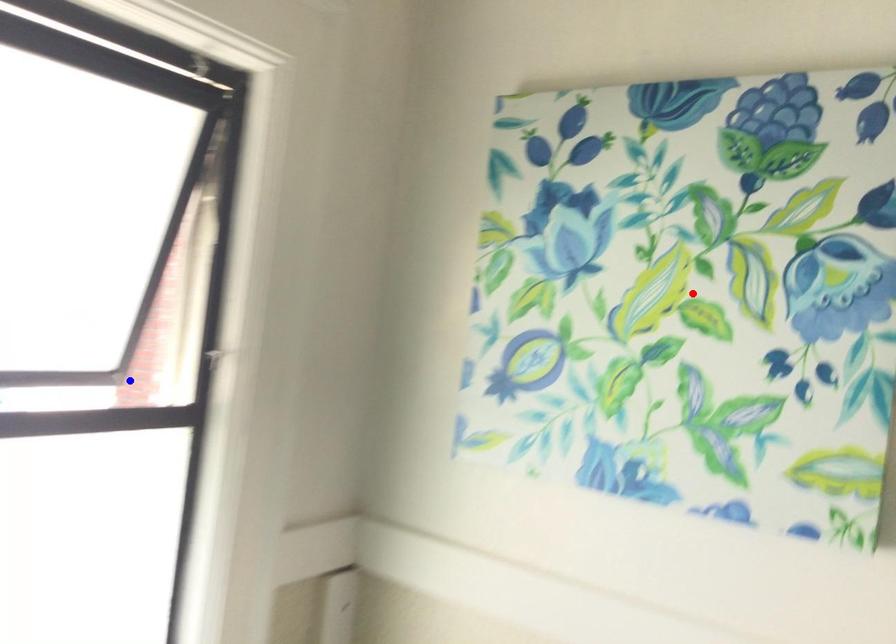
Question: Two points are marked on the image. Which point is closer to the camera?

Choices:
 (A) Blue point is closer.
 (B) Red point is closer.

Answer: (B)